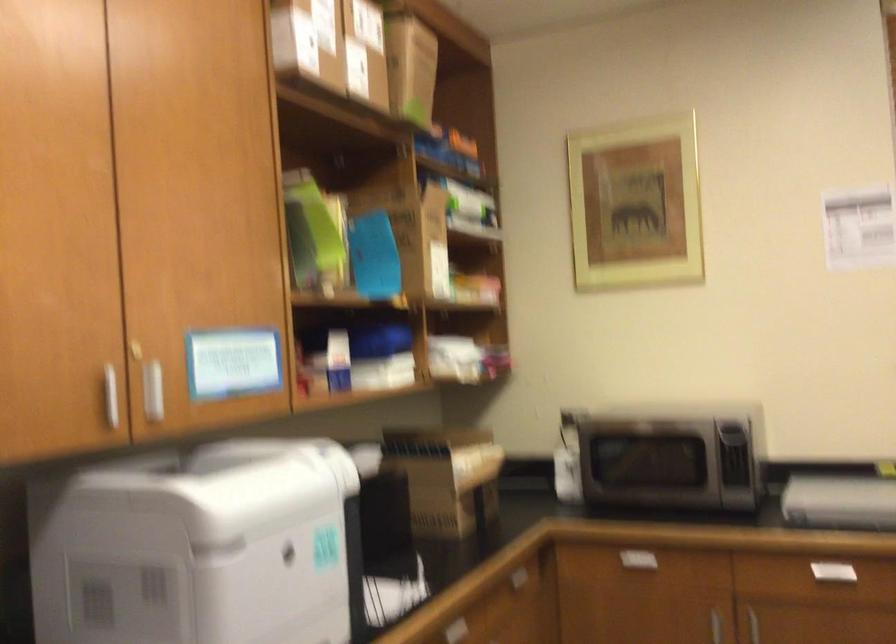
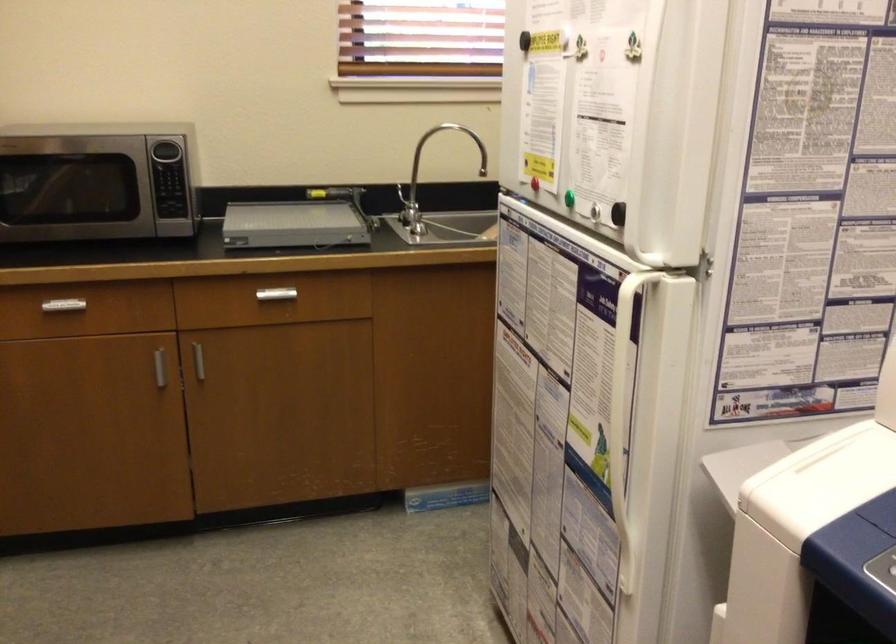
The images are taken continuously from a first-person perspective. In which direction is your viewpoint rotating?

The rotation direction of the camera is right-down.